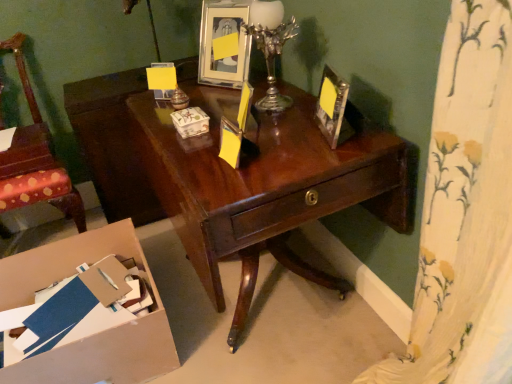
This screenshot has width=512, height=384. Find the location of `vacant location behind silver metallic candle holder at upper right`. vacant location behind silver metallic candle holder at upper right is located at coordinates (263, 90).